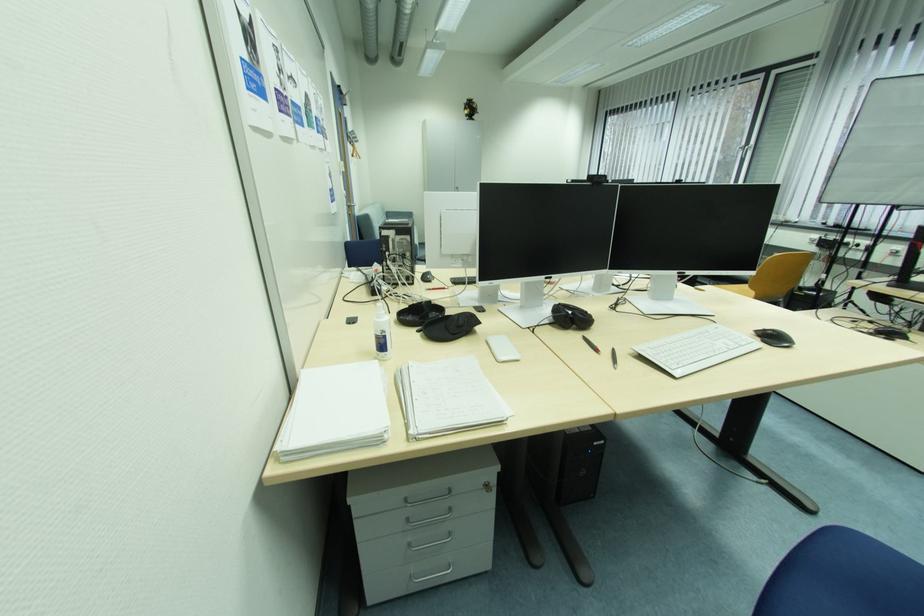
What do you see at coordinates (397, 227) in the screenshot? I see `the sofa sitting surface` at bounding box center [397, 227].